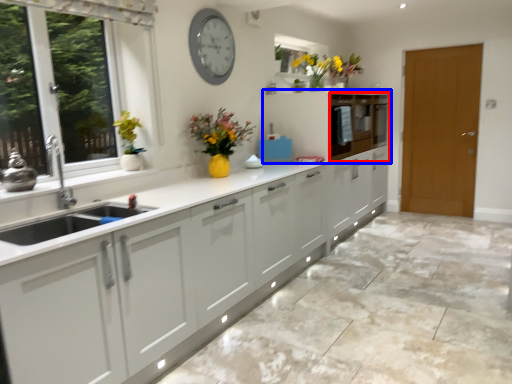
Question: Which object appears farthest to the camera in this image, cabinetry (highlighted by a red box) or cabinetry (highlighted by a blue box)?

Choices:
 (A) cabinetry
 (B) cabinetry

Answer: (A)